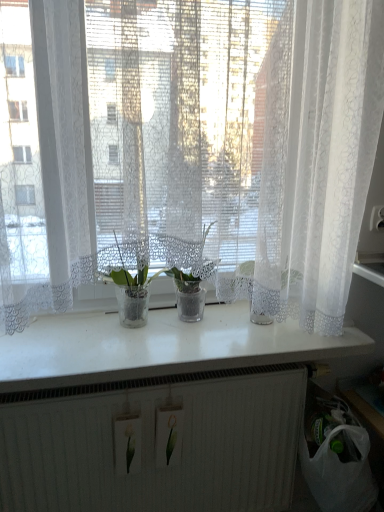
Question: Is clear glass vase at center, acting as the second houseplant starting from the right, taller or shorter than white glossy counter top at center?

Choices:
 (A) short
 (B) tall

Answer: (B)

Question: Is point (130, 274) closer or farther from the camera than point (188, 325)?

Choices:
 (A) closer
 (B) farther

Answer: (A)

Question: Estimate the real-world distances between objects in this image. Which object is farther from the translucent glass pot at center, marked as the second houseplant in a left-to-right arrangement?

Choices:
 (A) white ribbed radiator at lower center
 (B) clear glass vase at center, acting as the second houseplant starting from the right
 (C) white glossy counter top at center
 (D) white lace curtain at center

Answer: (A)

Question: Which is farther from the clear glass vase at center, acting as the second houseplant starting from the right?

Choices:
 (A) white glossy counter top at center
 (B) translucent glass pot at center, marked as the second houseplant in a left-to-right arrangement
 (C) white lace curtain at center
 (D) white ribbed radiator at lower center

Answer: (D)